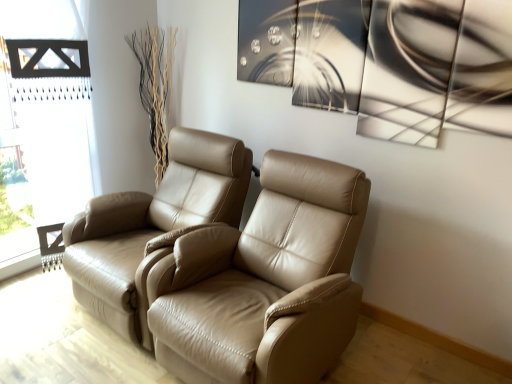
Question: Should I look upward or downward to see tan leather recliner at center, the first chair positioned from the right?

Choices:
 (A) up
 (B) down

Answer: (B)

Question: Can you see black wooden frame at left touching tan leather recliner at center, acting as the 2th chair starting from the left?

Choices:
 (A) yes
 (B) no

Answer: (B)

Question: From a real-world perspective, is black wooden frame at left positioned under tan leather recliner at center, acting as the 2th chair starting from the left, based on gravity?

Choices:
 (A) yes
 (B) no

Answer: (B)

Question: Can you confirm if black wooden frame at left is positioned to the right of tan leather recliner at center, the first chair positioned from the right?

Choices:
 (A) yes
 (B) no

Answer: (B)

Question: From the image's perspective, does black wooden frame at left appear lower than tan leather recliner at center, acting as the 2th chair starting from the left?

Choices:
 (A) yes
 (B) no

Answer: (B)

Question: Is black wooden frame at left closer to the viewer compared to tan leather recliner at center, acting as the 2th chair starting from the left?

Choices:
 (A) no
 (B) yes

Answer: (A)

Question: Considering the relative sizes of black wooden frame at left and tan leather recliner at center, acting as the 2th chair starting from the left, in the image provided, is black wooden frame at left bigger than tan leather recliner at center, acting as the 2th chair starting from the left,?

Choices:
 (A) yes
 (B) no

Answer: (B)

Question: Does tan leather recliner at center, the first chair positioned from the right, have a lesser height compared to tan leather chair at left, arranged as the second chair when viewed from the right?

Choices:
 (A) yes
 (B) no

Answer: (B)

Question: From the image's perspective, would you say tan leather recliner at center, the first chair positioned from the right, is shown under tan leather chair at left, arranged as the second chair when viewed from the right?

Choices:
 (A) no
 (B) yes

Answer: (B)

Question: Is tan leather recliner at center, acting as the 2th chair starting from the left, aimed at tan leather chair at left, the first chair in the left-to-right sequence?

Choices:
 (A) no
 (B) yes

Answer: (A)

Question: Does tan leather recliner at center, the first chair positioned from the right, come behind tan leather chair at left, arranged as the second chair when viewed from the right?

Choices:
 (A) no
 (B) yes

Answer: (A)

Question: Considering the relative positions of tan leather recliner at center, acting as the 2th chair starting from the left, and tan leather chair at left, arranged as the second chair when viewed from the right, in the image provided, is tan leather recliner at center, acting as the 2th chair starting from the left, to the right of tan leather chair at left, arranged as the second chair when viewed from the right, from the viewer's perspective?

Choices:
 (A) no
 (B) yes

Answer: (B)

Question: Considering the relative sizes of tan leather recliner at center, the first chair positioned from the right, and tan leather chair at left, the first chair in the left-to-right sequence, in the image provided, is tan leather recliner at center, the first chair positioned from the right, bigger than tan leather chair at left, the first chair in the left-to-right sequence,?

Choices:
 (A) no
 (B) yes

Answer: (B)

Question: Considering the relative sizes of tan leather recliner at center, acting as the 2th chair starting from the left, and black wooden frame at left in the image provided, is tan leather recliner at center, acting as the 2th chair starting from the left, thinner than black wooden frame at left?

Choices:
 (A) yes
 (B) no

Answer: (B)